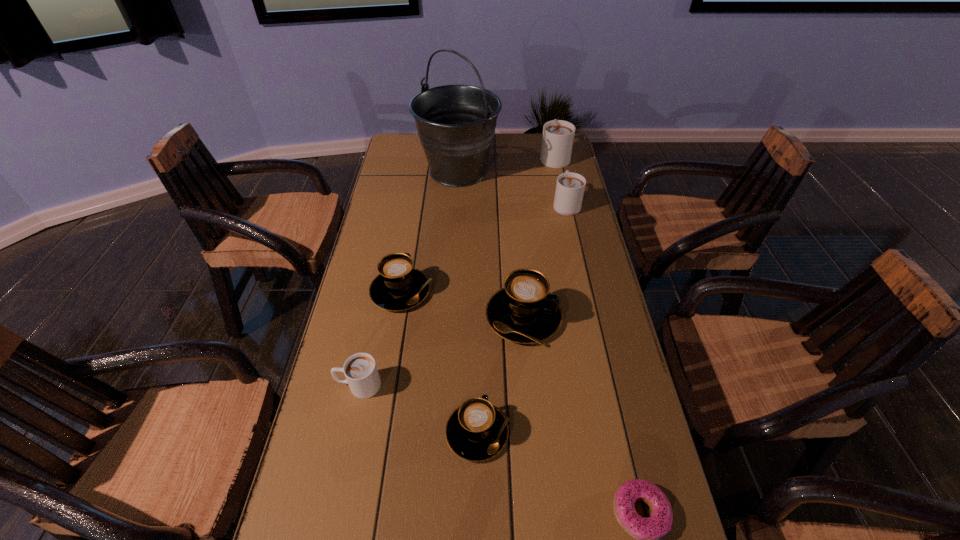
Identify the location of free point located 0.110m on the left of the nearest cappuccino. This screenshot has height=540, width=960. (396, 433).

Image resolution: width=960 pixels, height=540 pixels. I want to click on bucket that is at the far edge, so click(x=456, y=124).

Where is `cappuccino at the far edge`? The width and height of the screenshot is (960, 540). cappuccino at the far edge is located at coordinates (558, 135).

Identify the location of bucket that is positioned at the left edge. (456, 124).

Find the location of a particular element. The width and height of the screenshot is (960, 540). object that is at the far left corner is located at coordinates (456, 124).

I want to click on object that is positioned at the far right corner, so click(x=558, y=135).

The height and width of the screenshot is (540, 960). I want to click on free space at the far edge, so click(512, 140).

In the image, there is a desktop. Find the location of `vacant space at the left edge`. vacant space at the left edge is located at coordinates (400, 185).

Where is `vacant space at the right edge of the desktop`? The width and height of the screenshot is (960, 540). vacant space at the right edge of the desktop is located at coordinates (595, 256).

Locate an element on the screen. free location at the far left corner of the desktop is located at coordinates (419, 161).